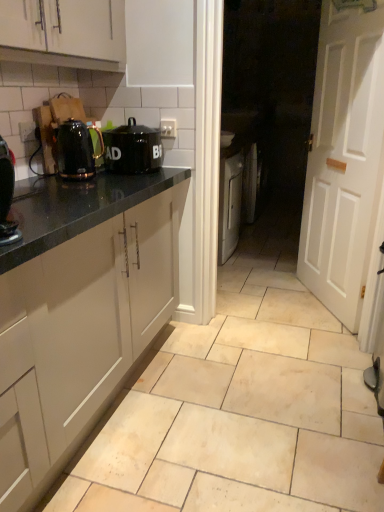
Find the location of a particular element. vacant space underneath white wooden door at right (from a real-world perspective) is located at coordinates (317, 304).